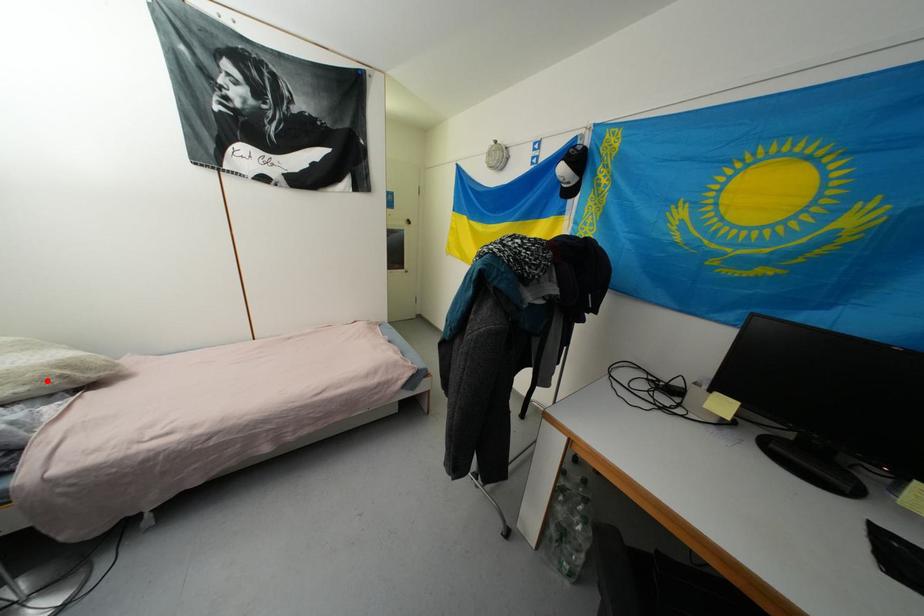
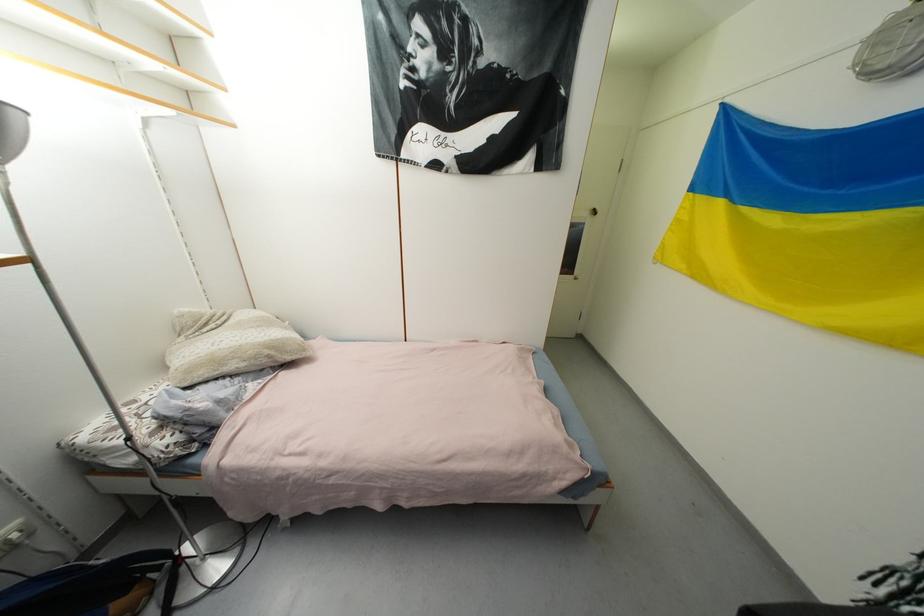
Find the pixel in the second image that matches the highlighted location in the first image.

(261, 359)